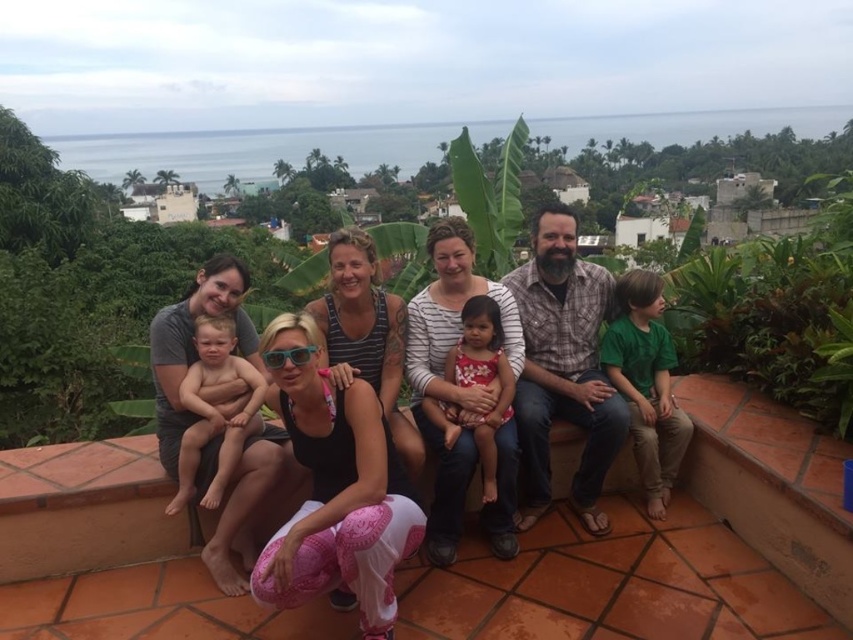
You are a delivery drone carrying a package that requires a 5 meter minimum distance to land safely. You need to land between the terracotta tile ledge at center and the green cotton shirt at right. Is there enough space?

The distance between the terracotta tile ledge at center and the green cotton shirt at right is 5.26 meters, which meets the 5 meter minimum requirement. Therefore, the drone can safely land between them.

You are a photographer trying to capture a photo of the group. The green cotton shirt at right and the floral fabric dress at center are partially blocking each other. Which one should you adjust to ensure both are fully visible in the photo?

The floral fabric dress at center is behind the green cotton shirt at right, so you should adjust the floral fabric dress at center to move it forward to ensure both are fully visible.